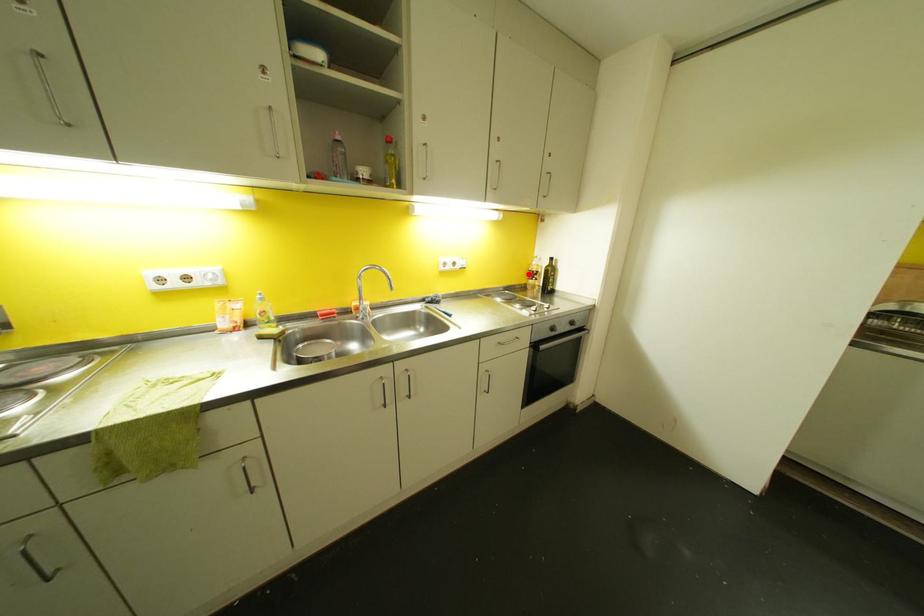
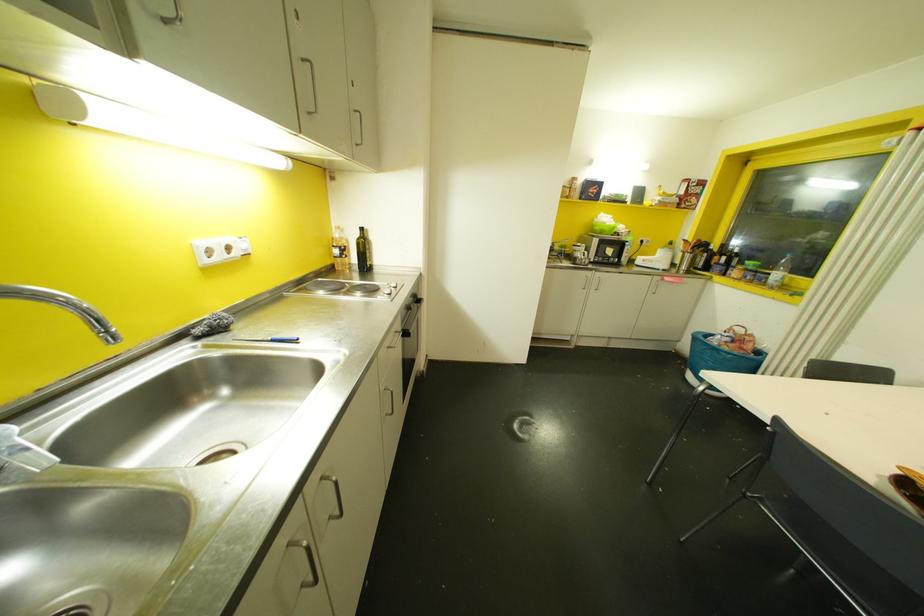
Where in the second image is the point corresponding to the highlighted location from the first image?

(335, 251)